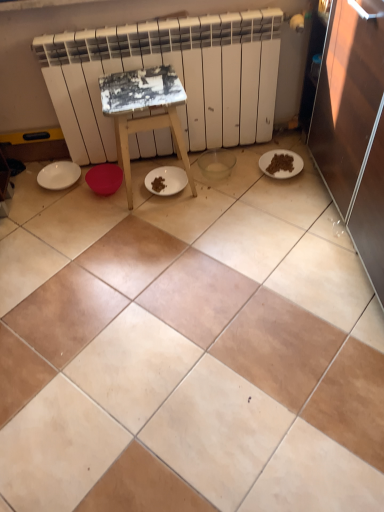
This screenshot has width=384, height=512. I want to click on unoccupied space behind white matte plate at lower right, which is the 2th paper plate from left to right, so click(276, 139).